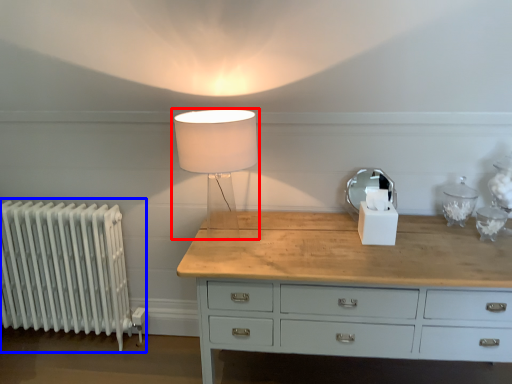
Question: Which of the following is the farthest to the observer, lamp (highlighted by a red box) or radiator (highlighted by a blue box)?

Choices:
 (A) lamp
 (B) radiator

Answer: (B)